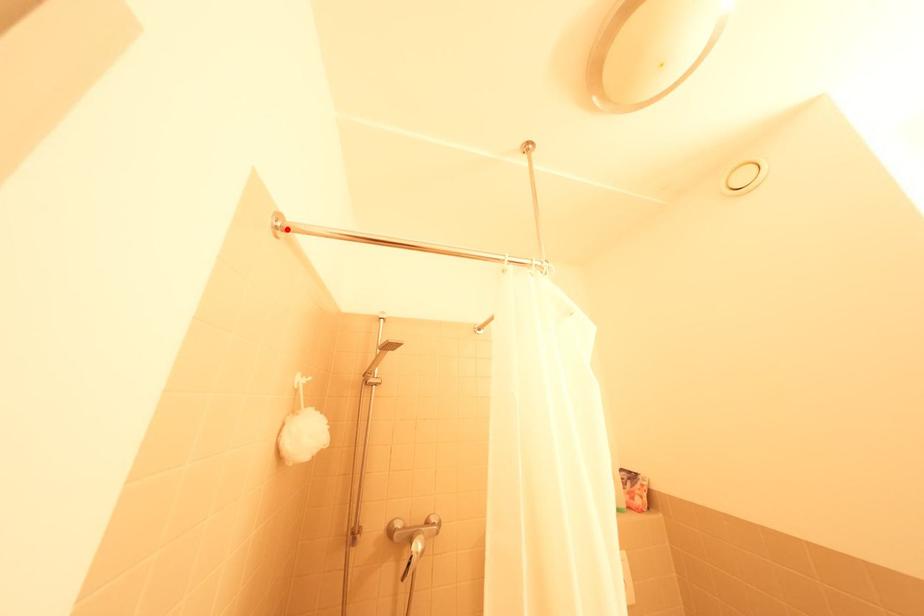
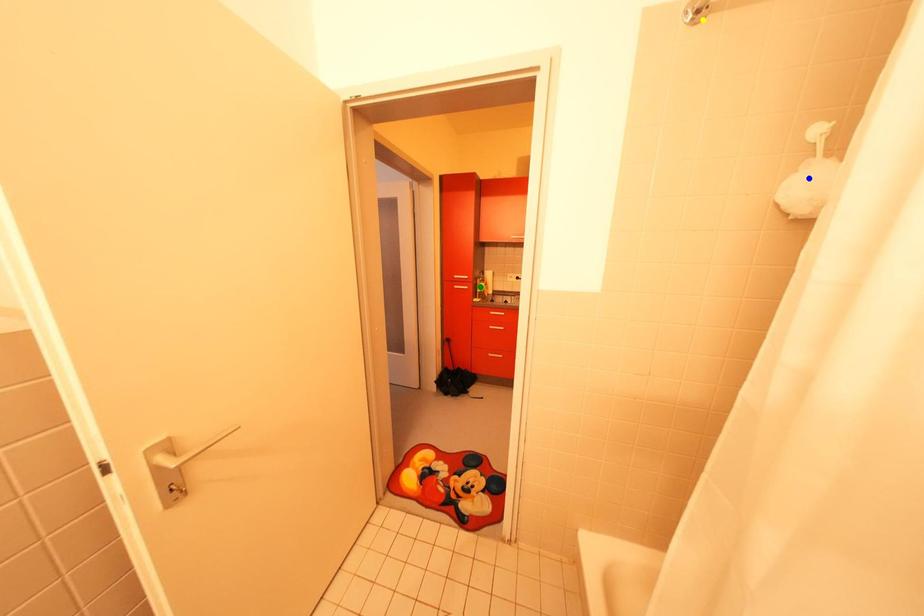
Question: I am providing you with two images of the same scene from different viewpoints. A red point is marked on the first image. You are given multiple points on the second image. Which point in image 2 represents the same 3d spot as the red point in image 1?

Choices:
 (A) blue point
 (B) yellow point
 (C) green point

Answer: (B)